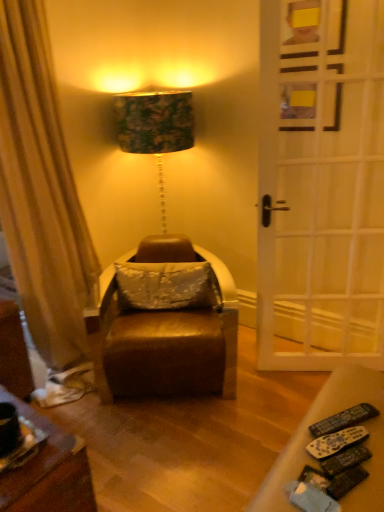
Question: Does white wooden door at right turn towards satin white pillow at center?

Choices:
 (A) no
 (B) yes

Answer: (A)

Question: Is satin white pillow at center at the back of white wooden door at right?

Choices:
 (A) no
 (B) yes

Answer: (A)

Question: From a real-world perspective, is white wooden door at right beneath satin white pillow at center?

Choices:
 (A) no
 (B) yes

Answer: (A)

Question: Is satin white pillow at center surrounded by white wooden door at right?

Choices:
 (A) yes
 (B) no

Answer: (B)

Question: From the image's perspective, is white wooden door at right over satin white pillow at center?

Choices:
 (A) yes
 (B) no

Answer: (A)

Question: Considering the positions of satin white pillow at center and black plastic remote control at lower right, arranged as the first remote control when viewed from the front, in the image, is satin white pillow at center taller or shorter than black plastic remote control at lower right, arranged as the first remote control when viewed from the front,?

Choices:
 (A) tall
 (B) short

Answer: (A)

Question: From the image's perspective, is satin white pillow at center located above or below black plastic remote control at lower right, arranged as the first remote control when viewed from the front?

Choices:
 (A) below
 (B) above

Answer: (B)

Question: Considering the positions of point (215, 303) and point (336, 433), is point (215, 303) closer or farther from the camera than point (336, 433)?

Choices:
 (A) closer
 (B) farther

Answer: (B)

Question: From a real-world perspective, relative to black plastic remote control at lower right, arranged as the first remote control when viewed from the front, is satin white pillow at center vertically above or below?

Choices:
 (A) above
 (B) below

Answer: (B)

Question: From a real-world perspective, relative to leather swivel chair at center, is satin white pillow at center vertically above or below?

Choices:
 (A) below
 (B) above

Answer: (B)

Question: Based on their positions, is satin white pillow at center located to the left or right of leather swivel chair at center?

Choices:
 (A) right
 (B) left

Answer: (A)

Question: From the image's perspective, relative to leather swivel chair at center, is satin white pillow at center above or below?

Choices:
 (A) below
 (B) above

Answer: (B)

Question: In terms of size, does satin white pillow at center appear bigger or smaller than leather swivel chair at center?

Choices:
 (A) big
 (B) small

Answer: (B)

Question: From the image's perspective, is leather swivel chair at center above or below black plastic remote control at lower right, arranged as the first remote control when viewed from the front?

Choices:
 (A) above
 (B) below

Answer: (A)

Question: Based on their positions, is leather swivel chair at center located to the left or right of black plastic remote control at lower right, which is the 2th remote control from back to front?

Choices:
 (A) right
 (B) left

Answer: (B)